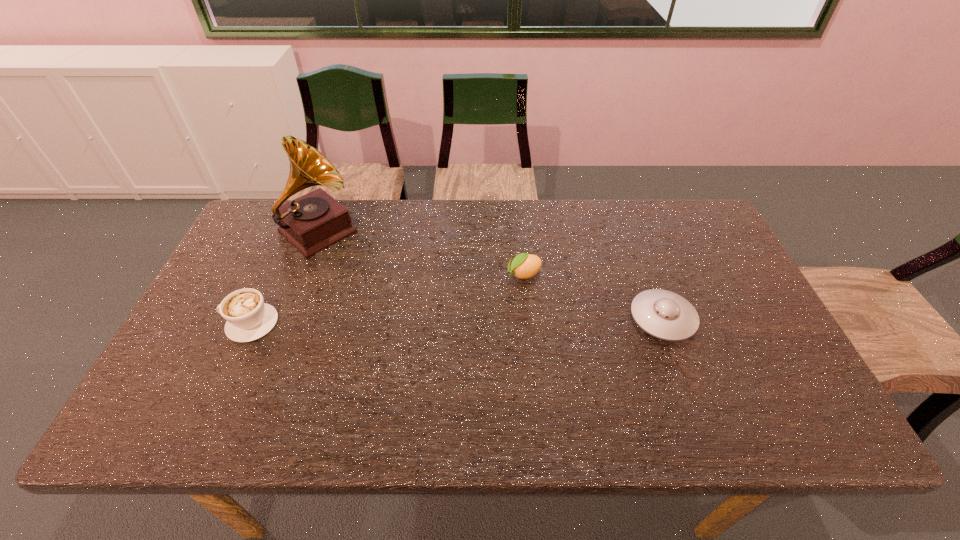
The width and height of the screenshot is (960, 540). Find the location of `vacant space at the right edge of the desktop`. vacant space at the right edge of the desktop is located at coordinates (735, 352).

Locate an element on the screen. This screenshot has height=540, width=960. free region at the far left corner is located at coordinates (261, 231).

In the image, there is a desktop. What are the coordinates of `vacant space at the near left corner` in the screenshot? It's located at (168, 381).

In the image, there is a desktop. Identify the location of blank space at the far right corner. (687, 212).

Where is `blank area at the near right corner`? blank area at the near right corner is located at coordinates (792, 395).

Identify the location of vacant area that lies between the cappuccino and the farthest object. (285, 278).

Where is `empty space between the tallest object and the third nearest object`? empty space between the tallest object and the third nearest object is located at coordinates (421, 253).

Identify the location of vacant space that is in between the tallest object and the cappuccino. The image size is (960, 540). (285, 278).

The width and height of the screenshot is (960, 540). Find the location of `vacant space that's between the farthest object and the lemon`. vacant space that's between the farthest object and the lemon is located at coordinates (421, 253).

Locate an element on the screen. The height and width of the screenshot is (540, 960). vacant region between the saucer and the lemon is located at coordinates (593, 296).